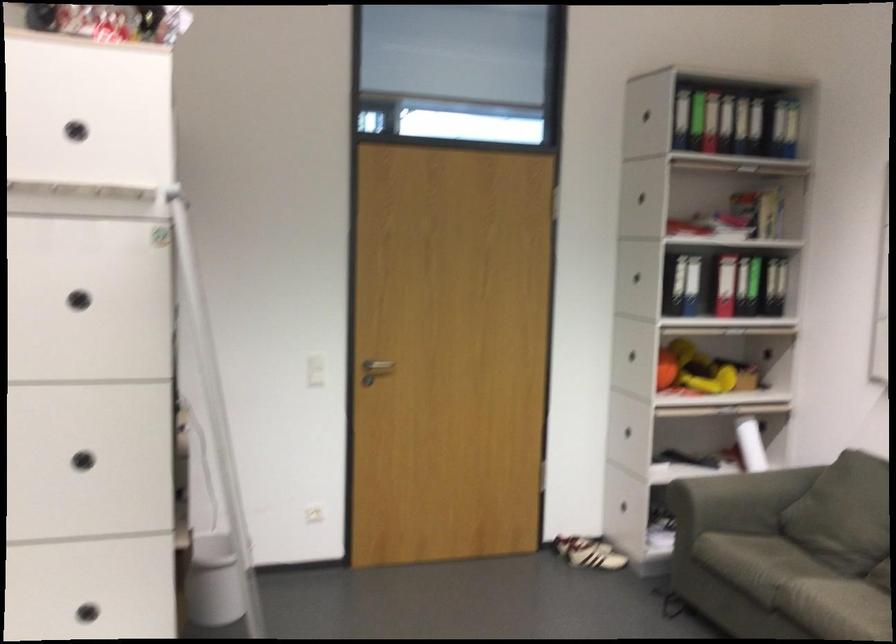
The location [213,581] corresponds to which object?

This point indicates the small gray trashcan.